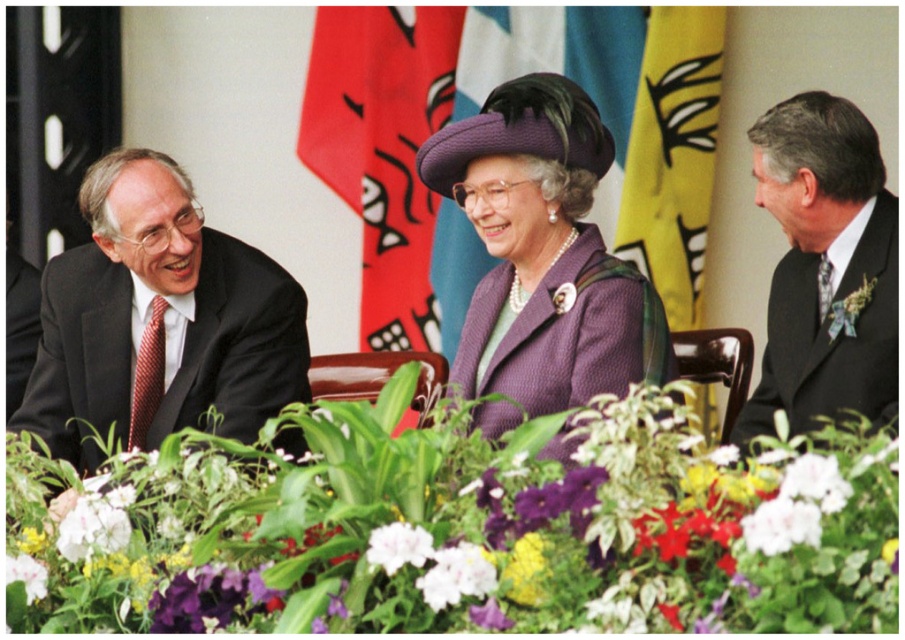
You are a florist arranging flowers for a formal event. You have two purple items to place on the table. The first is the vivid purple petals at center, and the second is the purple textured coat at center. Which item should you place in a position where it can be more easily seen from a distance?

The vivid purple petals at center should be placed in a position where it can be more easily seen from a distance because it has a larger size compared to the purple textured coat at center.